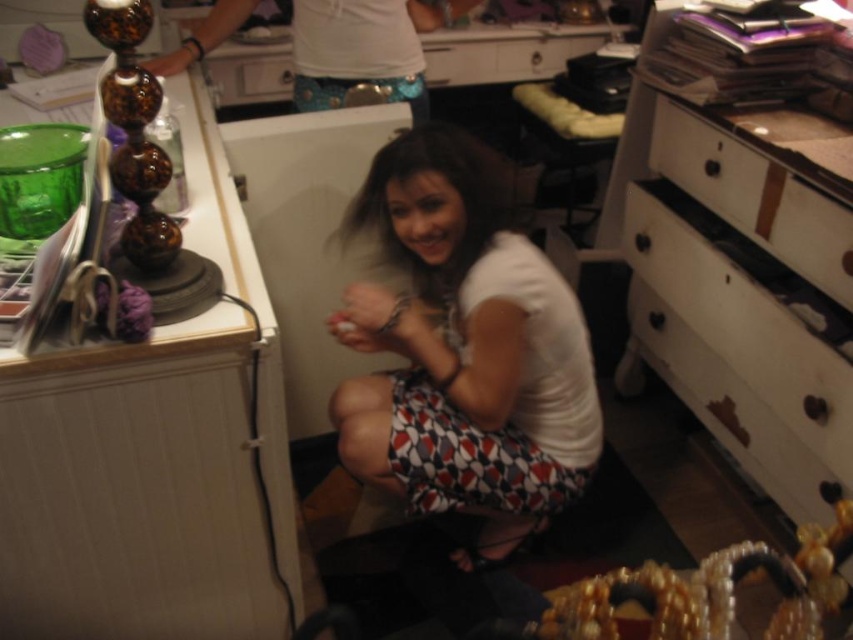
You are taking a photo of the scene and want to focus on both the point at (351, 397) and the point at (828, 365). Which point should you focus on first to ensure both are in focus?

You should focus on the point at (351, 397) first because it is closer to the camera. Since it is closer, focusing there will ensure the point at (828, 365), which is farther away, will also be in focus.

You are organizing your workspace and need to place a large box that requires more space. You see the white wood drawer at lower right and the white wood drawer at center right. Which drawer should you choose to place the box?

The white wood drawer at lower right has a greater width than the white wood drawer at center right, so you should choose the white wood drawer at lower right to place the box.